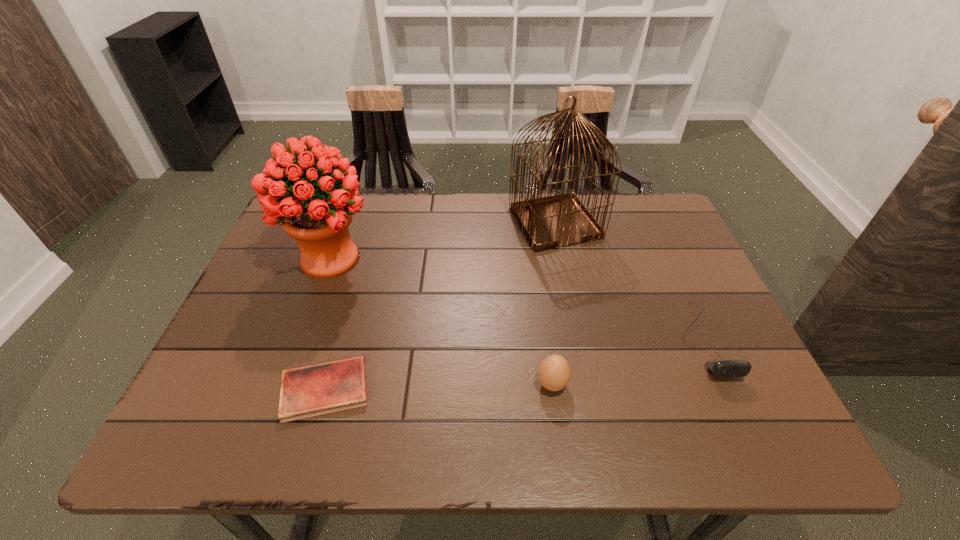
At what (x,y) coordinates should I click in order to perform the action: click on vacant space at the left edge of the desktop. Please return your answer as a coordinate pair (x, y). Image resolution: width=960 pixels, height=540 pixels. Looking at the image, I should click on (266, 376).

In the image, there is a desktop. Identify the location of vacant region at the right edge. (678, 276).

Locate an element on the screen. The height and width of the screenshot is (540, 960). vacant region at the near left corner is located at coordinates (266, 416).

Where is `vacant position at the near right corner of the desktop`? The width and height of the screenshot is (960, 540). vacant position at the near right corner of the desktop is located at coordinates (773, 429).

This screenshot has height=540, width=960. In order to click on vacant region between the birdcage and the bouquet in this screenshot , I will do `click(443, 241)`.

Image resolution: width=960 pixels, height=540 pixels. In order to click on unoccupied position between the shortest object and the third tallest object in this screenshot , I will do `click(439, 387)`.

Find the location of `vacant space that's between the diary and the bouquet`. vacant space that's between the diary and the bouquet is located at coordinates (328, 324).

This screenshot has width=960, height=540. What are the coordinates of `vacant point located between the birdcage and the webcam` in the screenshot? It's located at (629, 281).

Where is `vacant point located between the bouquet and the birdcage`? The width and height of the screenshot is (960, 540). vacant point located between the bouquet and the birdcage is located at coordinates (443, 241).

Image resolution: width=960 pixels, height=540 pixels. Find the location of `free spot between the bouquet and the rightmost object`. free spot between the bouquet and the rightmost object is located at coordinates (516, 299).